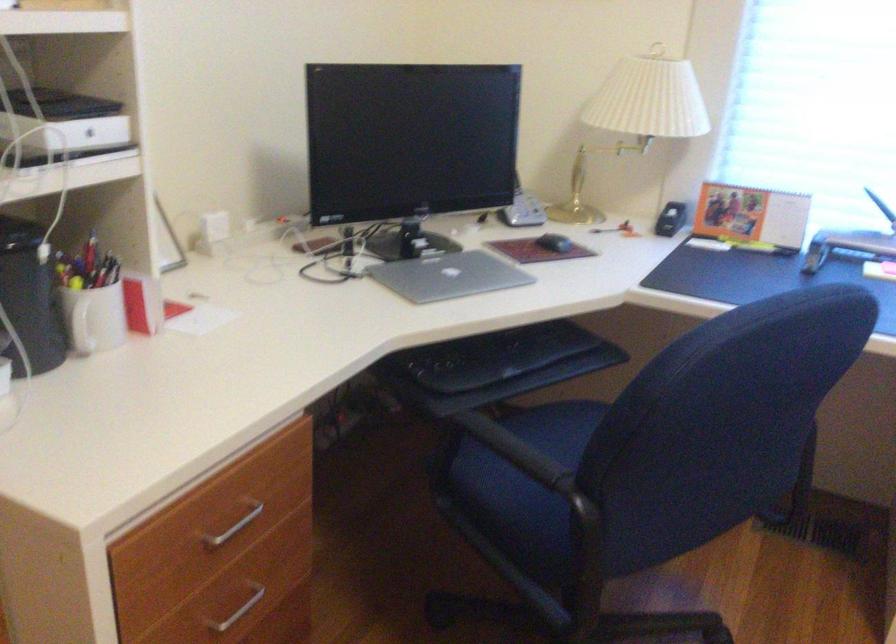
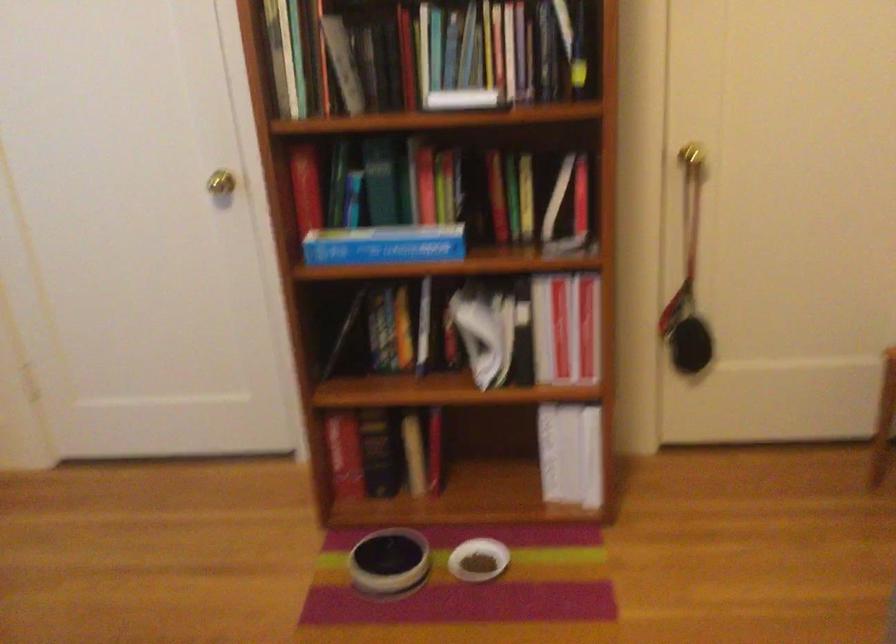
The images are taken continuously from a first-person perspective. In which direction is your viewpoint rotating?

The camera rotated toward right-down.